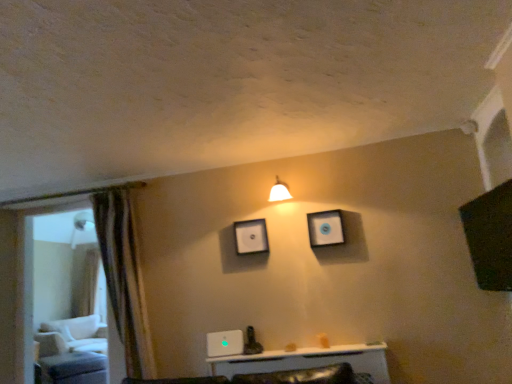
Question: Is white glossy light fixture at upper center looking in the opposite direction of matte white picture frame at upper center, arranged as the second picture frame when viewed from the left?

Choices:
 (A) no
 (B) yes

Answer: (A)

Question: Does white glossy light fixture at upper center contain matte white picture frame at upper center, arranged as the second picture frame when viewed from the left?

Choices:
 (A) no
 (B) yes

Answer: (A)

Question: Is white glossy light fixture at upper center closer to camera compared to matte white picture frame at upper center, which is counted as the second picture frame, starting from the back?

Choices:
 (A) yes
 (B) no

Answer: (A)

Question: From the image's perspective, is white glossy light fixture at upper center beneath matte white picture frame at upper center, arranged as the second picture frame when viewed from the left?

Choices:
 (A) yes
 (B) no

Answer: (B)

Question: Would you consider white glossy light fixture at upper center to be distant from matte white picture frame at upper center, which is counted as the first picture frame, starting from the right?

Choices:
 (A) no
 (B) yes

Answer: (A)

Question: Is matte black picture frame at upper center, the 2th picture frame in the right-to-left sequence, bigger or smaller than white glossy light fixture at upper center?

Choices:
 (A) big
 (B) small

Answer: (B)

Question: Is matte black picture frame at upper center, the first picture frame from the left, taller or shorter than white glossy light fixture at upper center?

Choices:
 (A) tall
 (B) short

Answer: (A)

Question: Considering the relative positions of matte black picture frame at upper center, which appears as the first picture frame when viewed from the back, and white glossy light fixture at upper center in the image provided, is matte black picture frame at upper center, which appears as the first picture frame when viewed from the back, to the left or to the right of white glossy light fixture at upper center?

Choices:
 (A) right
 (B) left

Answer: (B)

Question: From the image's perspective, is matte black picture frame at upper center, the second picture frame viewed from the front, above or below white glossy light fixture at upper center?

Choices:
 (A) above
 (B) below

Answer: (B)

Question: Based on their positions, is transparent glass door at left located to the left or right of white fabric swivel chair at left?

Choices:
 (A) left
 (B) right

Answer: (B)

Question: From a real-world perspective, relative to white fabric swivel chair at left, is transparent glass door at left vertically above or below?

Choices:
 (A) below
 (B) above

Answer: (B)

Question: From the image's perspective, relative to white fabric swivel chair at left, is transparent glass door at left above or below?

Choices:
 (A) above
 (B) below

Answer: (A)

Question: Is transparent glass door at left in front of or behind white fabric swivel chair at left in the image?

Choices:
 (A) front
 (B) behind

Answer: (A)

Question: Looking at their shapes, would you say matte black picture frame at upper center, which appears as the first picture frame when viewed from the back, is wider or thinner than white fabric swivel chair at left?

Choices:
 (A) wide
 (B) thin

Answer: (B)

Question: Is point (259, 228) positioned closer to the camera than point (101, 332)?

Choices:
 (A) closer
 (B) farther

Answer: (A)